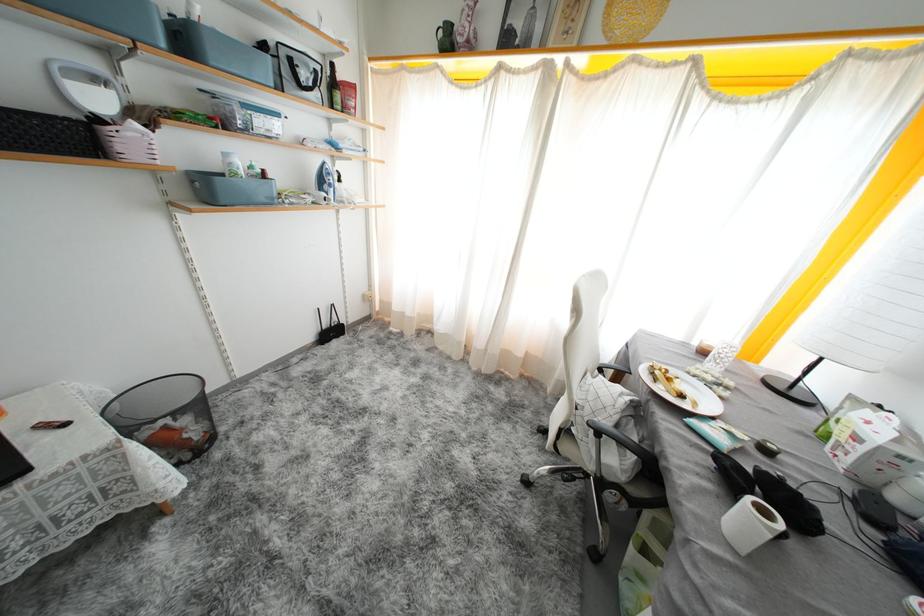
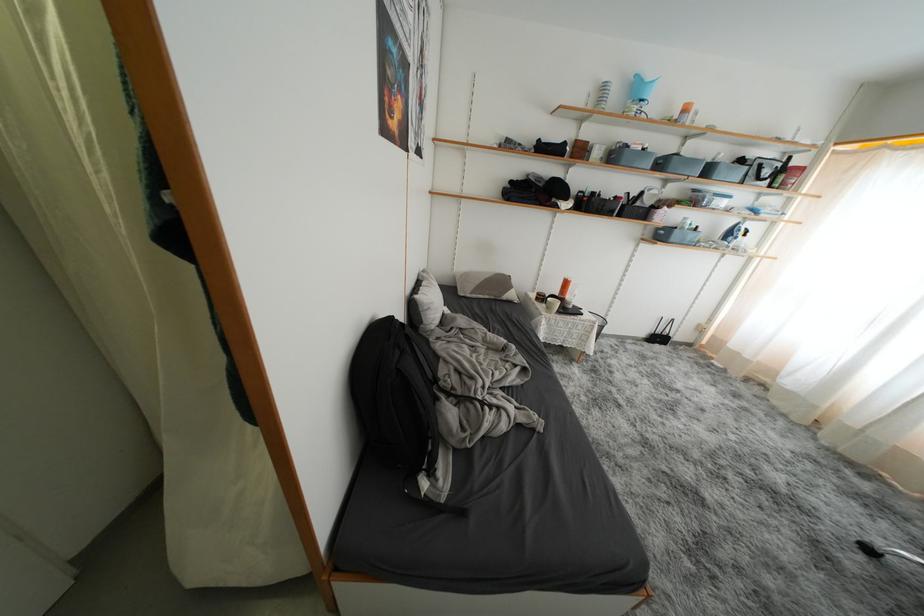
Locate, in the second image, the point that corresponds to (190,44) in the first image.

(714, 175)